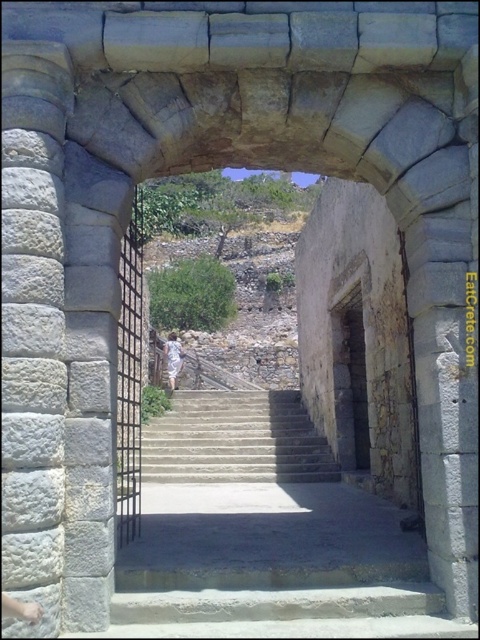
You are standing in front of the archway and need to walk to the smooth stone stairs at center. Which direction should you move relative to the white stone pillar at left?

You should move to the right of the white stone pillar at left to reach the smooth stone stairs at center since the pillar is positioned to the left of the stairs.

You are standing at the base of the stone archway and want to reach the rustic stone doorway at center. The smooth stone stairs at center are in your path. If you walk straight towards the doorway, will you have to climb the stairs?

The smooth stone stairs at center are 8.90 meters away from the rustic stone doorway at center, so walking straight towards the doorway would require climbing the stairs as they are directly in the path leading to the doorway.

You are standing in front of the stone archway and want to enter the stairway. Which object should you pass through first, the smooth stone stairs at center or the rustic stone doorway at center?

You should pass through the rustic stone doorway at center first because the smooth stone stairs at center is positioned under it, meaning the doorway is above and you must go through the doorway before reaching the stairs.